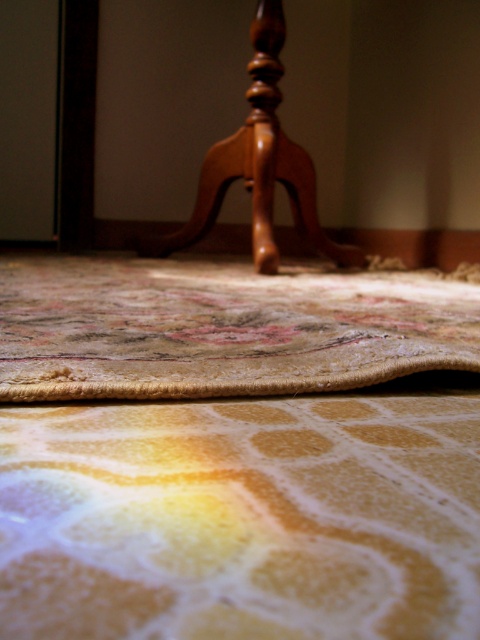
Question: Does carpeted floor at center appear on the left side of polished wood chair at upper center?

Choices:
 (A) no
 (B) yes

Answer: (B)

Question: Among these objects, which one is farthest from the camera?

Choices:
 (A) carpeted floor at center
 (B) polished wood chair at upper center

Answer: (B)

Question: Among these objects, which one is nearest to the camera?

Choices:
 (A) carpeted floor at center
 (B) polished wood chair at upper center

Answer: (A)

Question: Is carpeted floor at center positioned in front of polished wood chair at upper center?

Choices:
 (A) no
 (B) yes

Answer: (B)

Question: Which object appears farthest from the camera in this image?

Choices:
 (A) carpeted floor at center
 (B) polished wood chair at upper center

Answer: (B)

Question: Can you confirm if carpeted floor at center is positioned above polished wood chair at upper center?

Choices:
 (A) yes
 (B) no

Answer: (B)